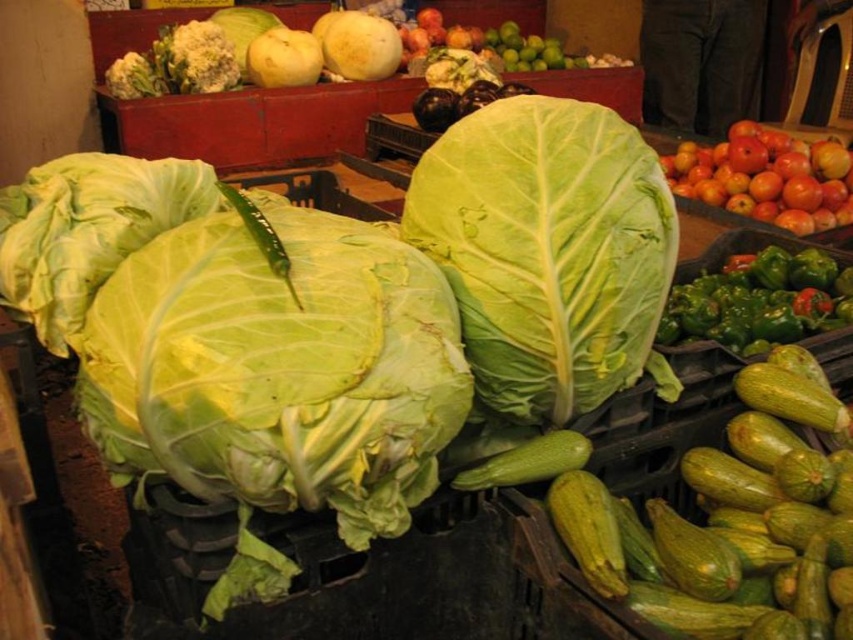
Which is more to the left, green leafy cabbage at center or green matte pepper at right?

Positioned to the left is green leafy cabbage at center.

Identify the location of green leafy cabbage at center. The image size is (853, 640). (277, 368).

Does green leafy cabbage at center have a greater height compared to green matte cabbage at left?

Indeed, green leafy cabbage at center has a greater height compared to green matte cabbage at left.

Does green leafy cabbage at center appear on the left side of green matte cabbage at left?

In fact, green leafy cabbage at center is to the right of green matte cabbage at left.

Is point (113, 323) farther from viewer compared to point (15, 253)?

No, it is in front of (15, 253).

The image size is (853, 640). What are the coordinates of `green leafy cabbage at center` in the screenshot? It's located at (277, 368).

Is point (671, 396) positioned in front of point (6, 244)?

No, it is behind (6, 244).

This screenshot has height=640, width=853. What are the coordinates of `green leafy at center` in the screenshot? It's located at (547, 250).